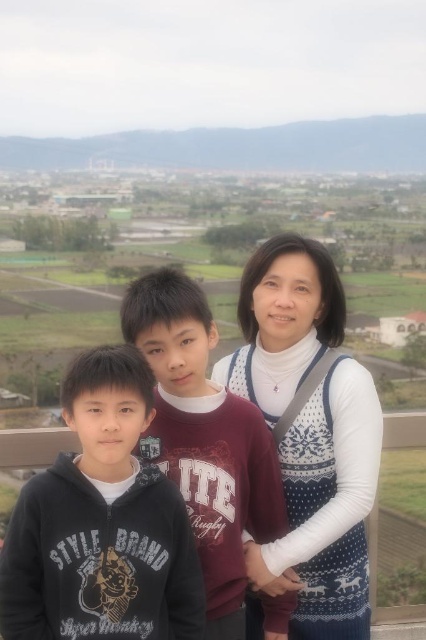
Is point (261, 627) closer to viewer compared to point (226, 468)?

No, (261, 627) is further to viewer.

Who is lower down, white knitted sweater at center or matte black hoodie at center?

white knitted sweater at center is below.

Does point (362, 433) come farther from viewer compared to point (158, 374)?

No, it is not.

Find the location of `white knitted sweater at center`. white knitted sweater at center is located at coordinates (310, 435).

Is white sweater at center shorter than white knitted sweater at center?

No, white sweater at center is not shorter than white knitted sweater at center.

Who is taller, white sweater at center or white knitted sweater at center?

white sweater at center is taller.

Is point (317, 429) positioned behind point (362, 497)?

Yes, it is.

You are a GUI agent. You are given a task and a screenshot of the screen. Output one action in this format:
    pyautogui.click(x=<x>, y=<y>)
    Task: Click on the white sweater at center
    The width and height of the screenshot is (426, 640).
    Given the screenshot: What is the action you would take?
    pyautogui.click(x=308, y=435)

Can you confirm if white sweater at center is wider than matte black hoodie at center?

Yes, white sweater at center is wider than matte black hoodie at center.

Can you confirm if white sweater at center is bigger than matte black hoodie at center?

Indeed, white sweater at center has a larger size compared to matte black hoodie at center.

Is point (149, 285) positioned in front of point (195, 301)?

That is True.

The height and width of the screenshot is (640, 426). I want to click on white sweater at center, so click(308, 435).